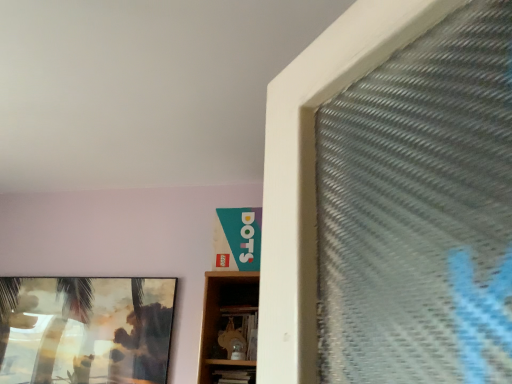
The image size is (512, 384). What do you see at coordinates (85, 329) in the screenshot?
I see `matte glass picture frame at lower left` at bounding box center [85, 329].

Where is `matte glass picture frame at lower left`? The image size is (512, 384). matte glass picture frame at lower left is located at coordinates (85, 329).

Locate an element on the screen. This screenshot has height=384, width=512. matte glass picture frame at lower left is located at coordinates (85, 329).